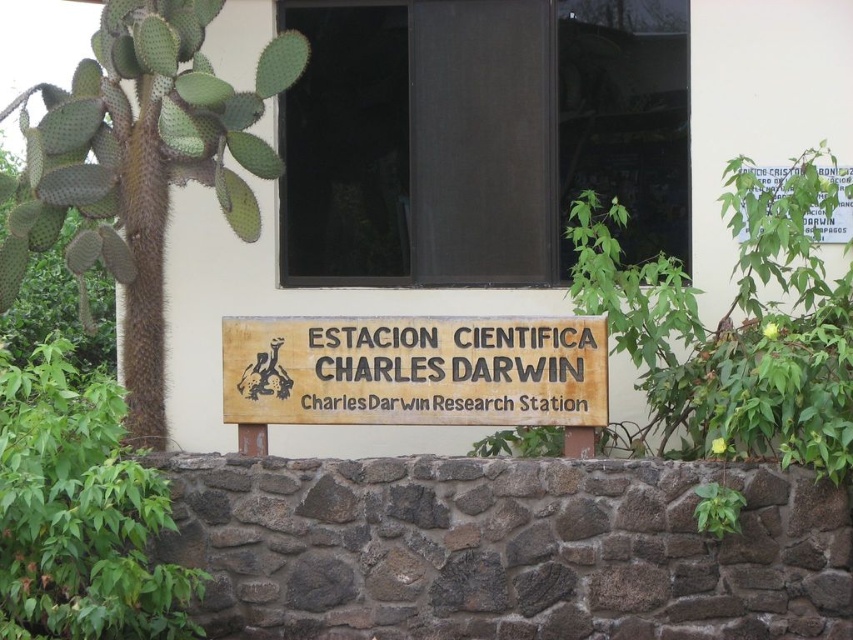
Which is in front, point (84, 147) or point (740, 237)?

Positioned in front is point (84, 147).

Who is more distant from viewer, (152, 12) or (784, 188)?

The point (784, 188) is more distant.

Between point (177, 92) and point (827, 180), which one is positioned behind?

Positioned behind is point (827, 180).

Find the location of `green spiny cactus at left`. green spiny cactus at left is located at coordinates (140, 166).

Between wooden sign at center and white paper sign at upper right, which one appears on the left side from the viewer's perspective?

wooden sign at center is more to the left.

Who is more distant from viewer, (405,401) or (747,166)?

Positioned behind is point (747,166).

Is point (548, 371) positioned behind point (846, 211)?

No, (548, 371) is closer to viewer.

Image resolution: width=853 pixels, height=640 pixels. What are the coordinates of `wooden sign at center` in the screenshot? It's located at (415, 371).

This screenshot has width=853, height=640. Describe the element at coordinates (140, 166) in the screenshot. I see `green spiny cactus at left` at that location.

Does point (107, 140) come closer to viewer compared to point (305, 384)?

No, (107, 140) is behind (305, 384).

The height and width of the screenshot is (640, 853). In order to click on green spiny cactus at left in this screenshot , I will do `click(140, 166)`.